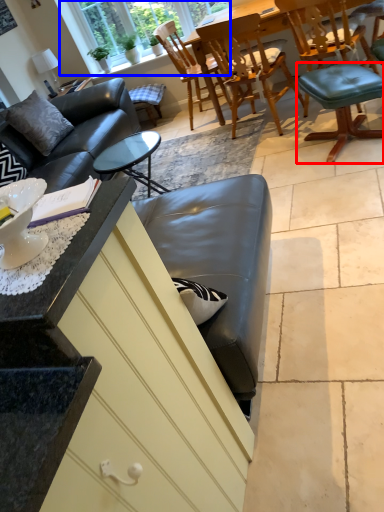
Question: Which object appears farthest to the camera in this image, bar stool (highlighted by a red box) or window (highlighted by a blue box)?

Choices:
 (A) bar stool
 (B) window

Answer: (B)